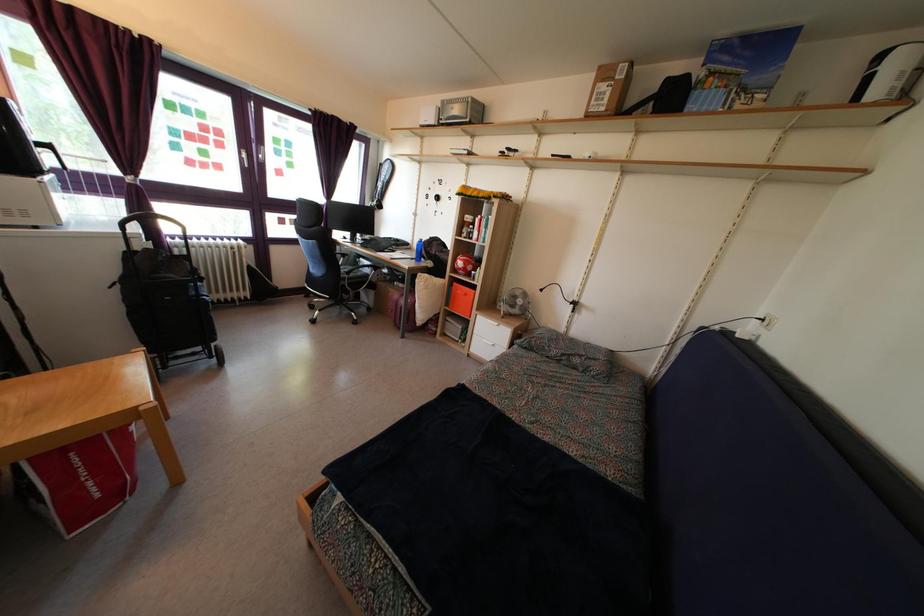
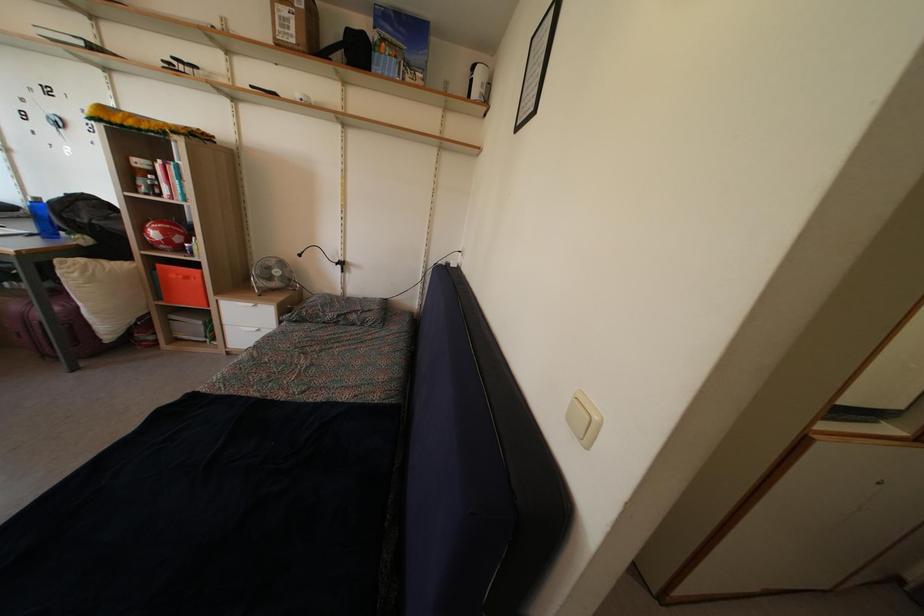
Locate, in the second image, the point that corresponds to point 463,272 in the first image.

(157, 243)